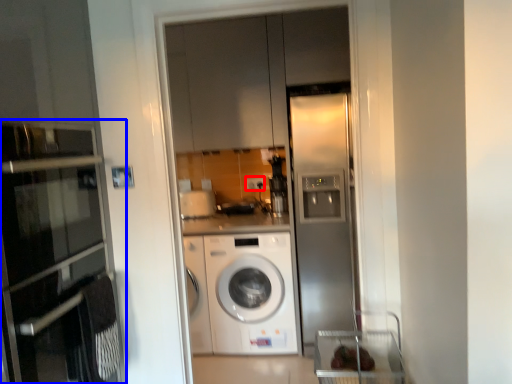
Question: Which object appears closest to the camera in this image, electric outlet (highlighted by a red box) or oven (highlighted by a blue box)?

Choices:
 (A) electric outlet
 (B) oven

Answer: (B)